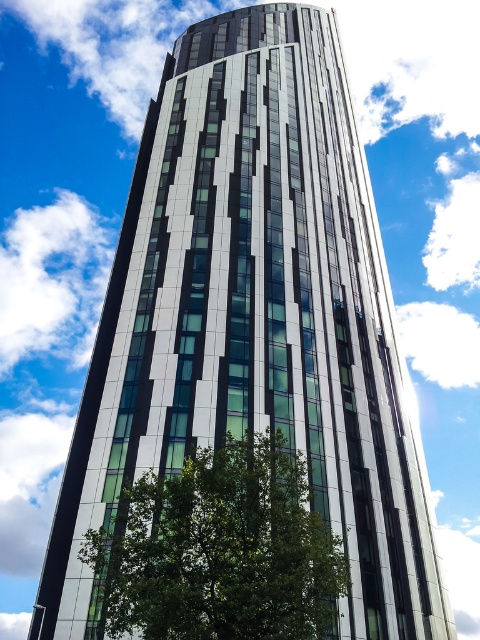
Can you confirm if green leafy tree at lower center is positioned below white fluffy cloud at upper center?

Yes, green leafy tree at lower center is below white fluffy cloud at upper center.

What do you see at coordinates (219, 548) in the screenshot? This screenshot has width=480, height=640. I see `green leafy tree at lower center` at bounding box center [219, 548].

Where is `green leafy tree at lower center`? The image size is (480, 640). green leafy tree at lower center is located at coordinates (219, 548).

Can you confirm if white fluffy cloud at upper left is taller than white fluffy cloud at upper center?

Correct, white fluffy cloud at upper left is much taller as white fluffy cloud at upper center.

Where is `white fluffy cloud at upper left`? The image size is (480, 640). white fluffy cloud at upper left is located at coordinates (52, 278).

In the scene shown: Which is above, green leafy tree at lower center or white fluffy cloud at upper left?

Positioned higher is white fluffy cloud at upper left.

Who is positioned more to the right, green leafy tree at lower center or white fluffy cloud at upper left?

Positioned to the right is green leafy tree at lower center.

I want to click on green leafy tree at lower center, so click(219, 548).